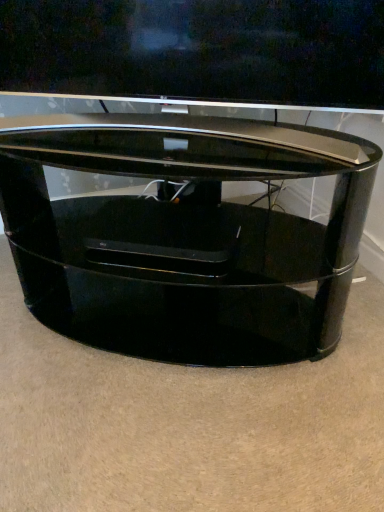
What do you see at coordinates (184, 236) in the screenshot? I see `glossy black table at center` at bounding box center [184, 236].

This screenshot has width=384, height=512. Find the location of `glossy black table at center`. glossy black table at center is located at coordinates (184, 236).

Looking at this image, measure the distance between point (107, 200) and camera.

Point (107, 200) is 1.16 meters from camera.

You are a GUI agent. You are given a task and a screenshot of the screen. Output one action in this format:
    pyautogui.click(x=<x>, y=<y>)
    Task: Click on the glossy black table at center
    Image resolution: width=384 pixels, height=512 pixels.
    Given the screenshot: What is the action you would take?
    pyautogui.click(x=184, y=236)